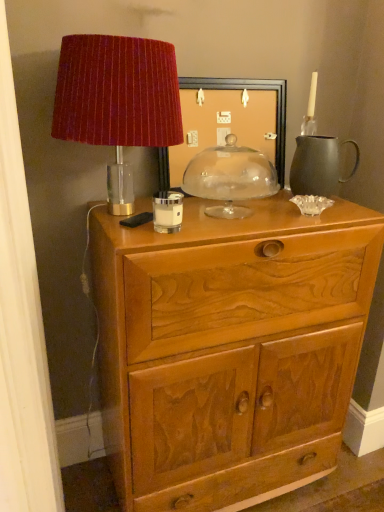
Locate an element on the screen. free space between matte black pitcher at right and white glass candle holder at center, which ranks as the 2th candle holder in right-to-left order is located at coordinates tap(246, 213).